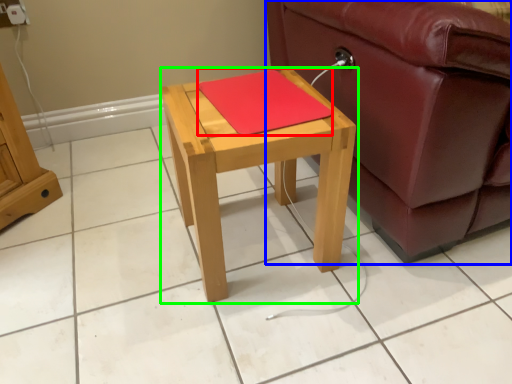
Question: Considering the real-world distances, which object is closest to pad (highlighted by a red box)? studio couch (highlighted by a blue box) or table (highlighted by a green box).

Choices:
 (A) studio couch
 (B) table

Answer: (B)